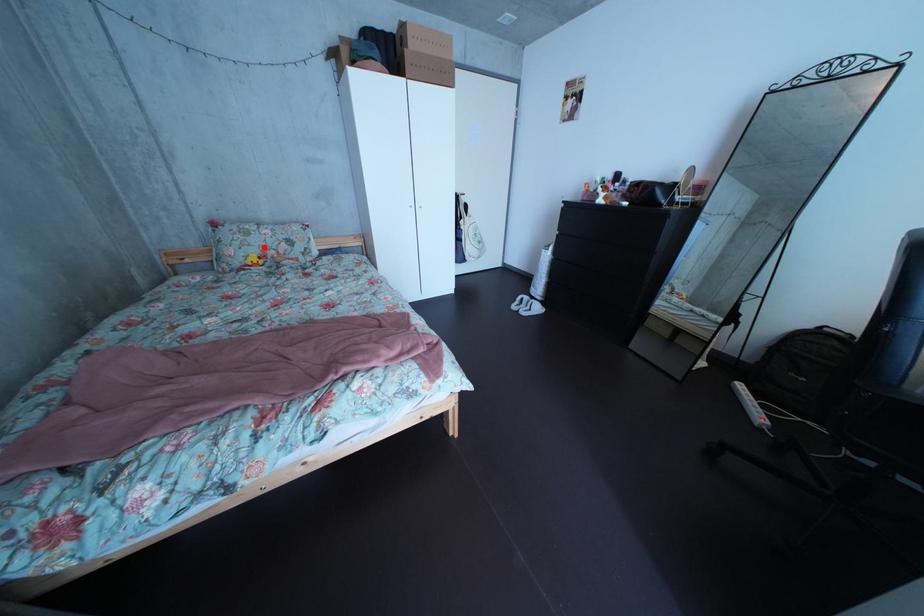
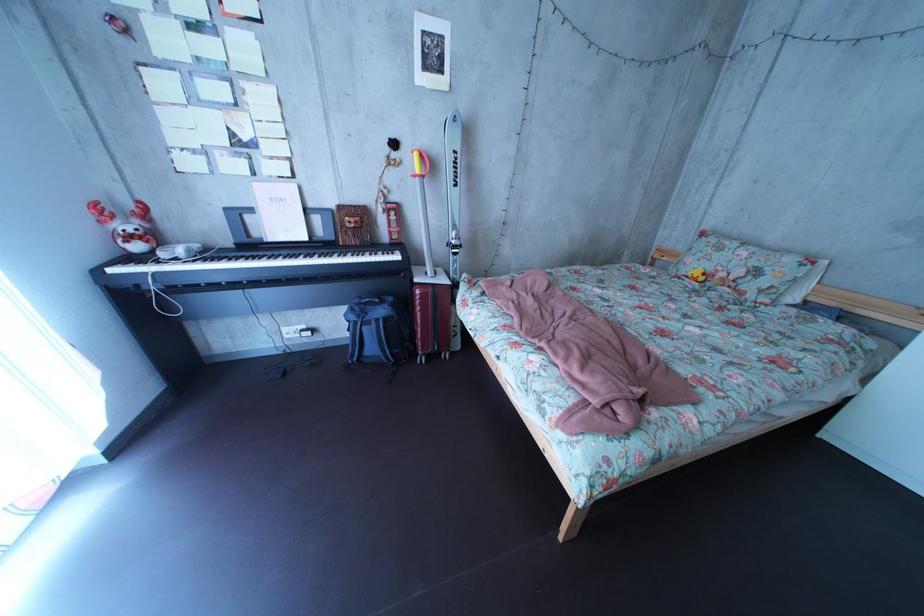
Question: A red point is marked in image1. In image2, is the corresponding 3D point closer to the camera or farther? Reply with the corresponding letter.

Choices:
 (A) The corresponding 3D point is closer.
 (B) The corresponding 3D point is farther.

Answer: (B)